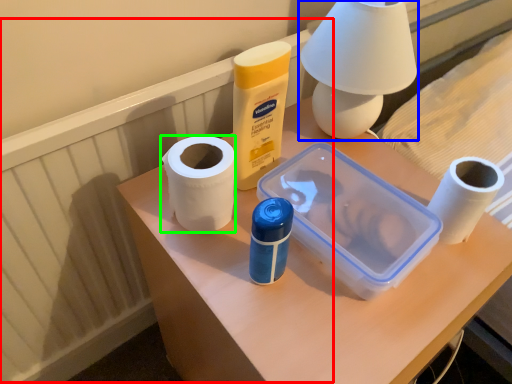
Question: Which object is the farthest from radiator (highlighted by a red box)? Choose among these: table lamp (highlighted by a blue box) or paper towel (highlighted by a green box).

Choices:
 (A) table lamp
 (B) paper towel

Answer: (A)